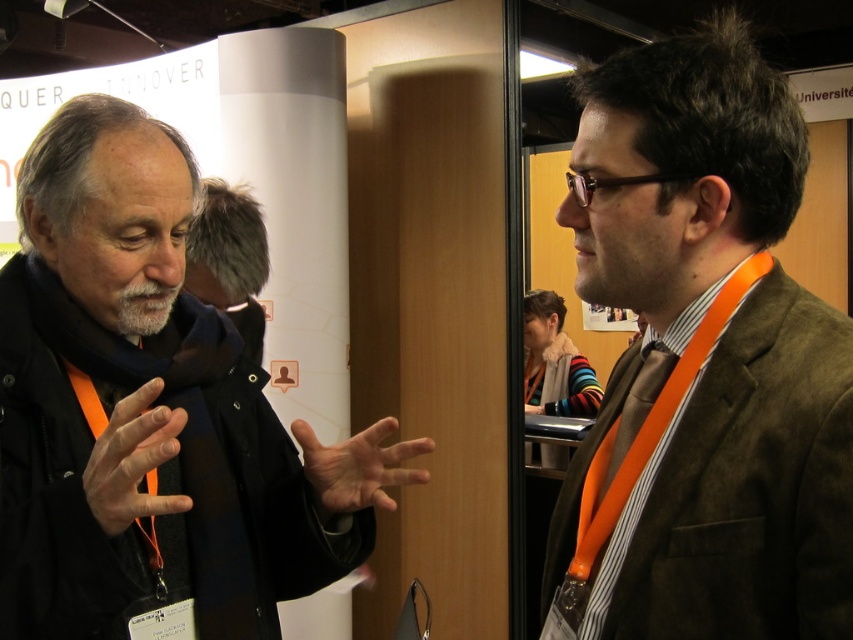
Where is `brown woolen suit at right`? The image size is (853, 640). brown woolen suit at right is located at coordinates (703, 360).

Does brown woolen suit at right appear on the right side of matte black jacket at left?

Correct, you'll find brown woolen suit at right to the right of matte black jacket at left.

What do you see at coordinates (703, 360) in the screenshot? I see `brown woolen suit at right` at bounding box center [703, 360].

Locate an element on the screen. The image size is (853, 640). brown woolen suit at right is located at coordinates (703, 360).

Find the location of a particular element. This screenshot has width=853, height=640. brown woolen suit at right is located at coordinates (703, 360).

Is brown woolen suit at right taller than fuzzy gray hat at upper left?

Correct, brown woolen suit at right is much taller as fuzzy gray hat at upper left.

What are the coordinates of `brown woolen suit at right` in the screenshot? It's located at (703, 360).

Locate an element on the screen. brown woolen suit at right is located at coordinates (703, 360).

What do you see at coordinates (151, 412) in the screenshot? The height and width of the screenshot is (640, 853). I see `matte black jacket at left` at bounding box center [151, 412].

Who is more distant from viewer, (3, 579) or (267, 253)?

Point (267, 253)

Find the location of a particular element. Image resolution: width=853 pixels, height=640 pixels. matte black jacket at left is located at coordinates (151, 412).